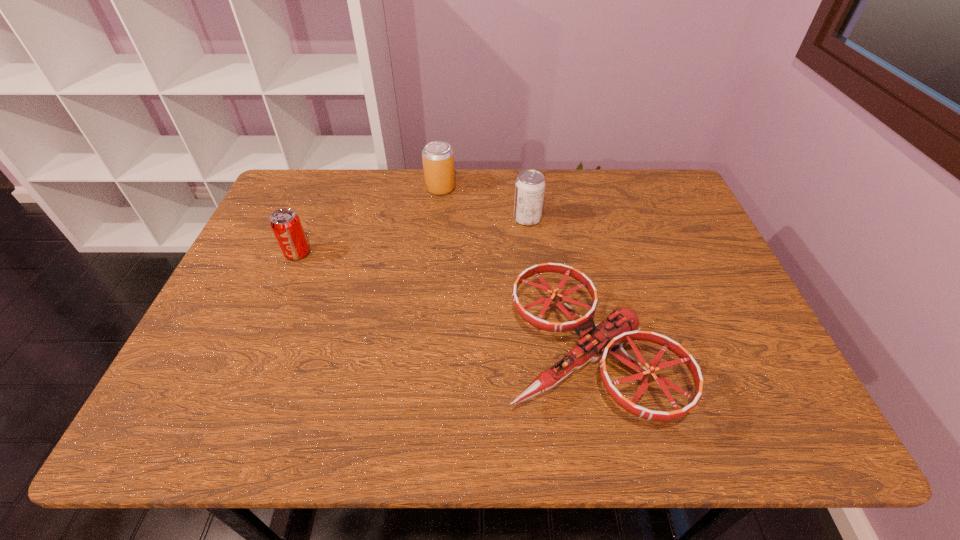
Identify the location of the farthest object. (438, 158).

The height and width of the screenshot is (540, 960). I want to click on the second soda can from right to left, so click(438, 158).

I want to click on the second nearest soda can, so click(x=530, y=185).

Where is `the third nearest object`? This screenshot has width=960, height=540. the third nearest object is located at coordinates (530, 185).

The width and height of the screenshot is (960, 540). Identify the location of the leftmost object. (285, 223).

Where is `the nearest soda can`? the nearest soda can is located at coordinates point(285,223).

In order to click on the nearest object in this screenshot , I will do (x=596, y=340).

Find the location of a particular element. This screenshot has width=960, height=540. the shortest object is located at coordinates (596, 340).

In order to click on vacant space situated 0.380m on the left of the farthest object in this screenshot , I will do `click(305, 188)`.

This screenshot has height=540, width=960. What are the coordinates of `vacant space located 0.070m on the front of the second farthest object` in the screenshot? It's located at (530, 244).